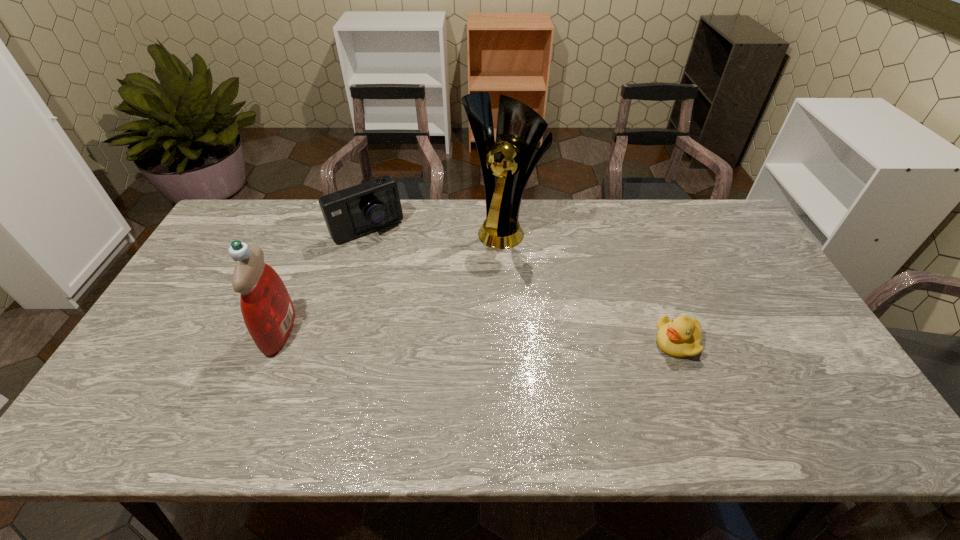
You are a GUI agent. You are given a task and a screenshot of the screen. Output one action in this format:
    pyautogui.click(x=<x>, y=<y>)
    Task: Click on the vacant space on the desktop that is between the detergent and the duckling and is positioned at the front of the tallest object, where the globe is visible
    This screenshot has height=540, width=960.
    Given the screenshot: What is the action you would take?
    pyautogui.click(x=426, y=335)

This screenshot has height=540, width=960. I want to click on free spot on the desktop that is between the second tallest object and the shortest object and is positioned on the front-facing side of the third tallest object, so click(435, 336).